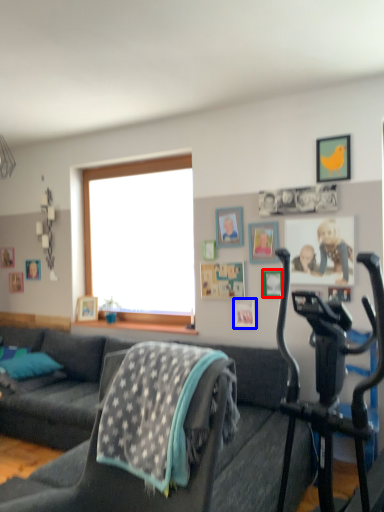
Question: Which point is further to the camera, picture frame (highlighted by a red box) or picture frame (highlighted by a blue box)?

Choices:
 (A) picture frame
 (B) picture frame

Answer: (B)